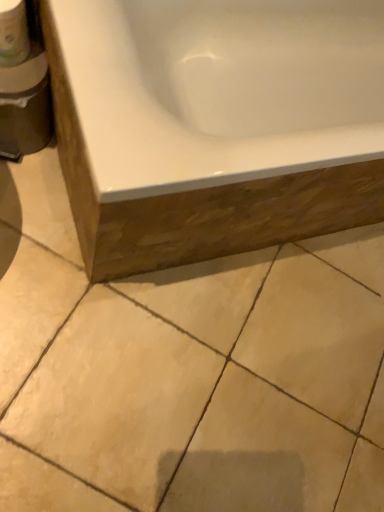
Question: Does point [x=11, y=66] appear closer or farther from the camera than point [x=49, y=406]?

Choices:
 (A) farther
 (B) closer

Answer: (B)

Question: Based on their sizes in the image, would you say white matte toilet paper at upper left is bigger or smaller than beige ceramic tile at lower center?

Choices:
 (A) big
 (B) small

Answer: (B)

Question: Estimate the real-world distances between objects in this image. Which object is closer to the white matte toilet paper at upper left?

Choices:
 (A) beige ceramic tile at lower center
 (B) white glossy bathtub at upper center

Answer: (B)

Question: Which of these objects is positioned closest to the white glossy bathtub at upper center?

Choices:
 (A) white matte toilet paper at upper left
 (B) beige ceramic tile at lower center

Answer: (B)